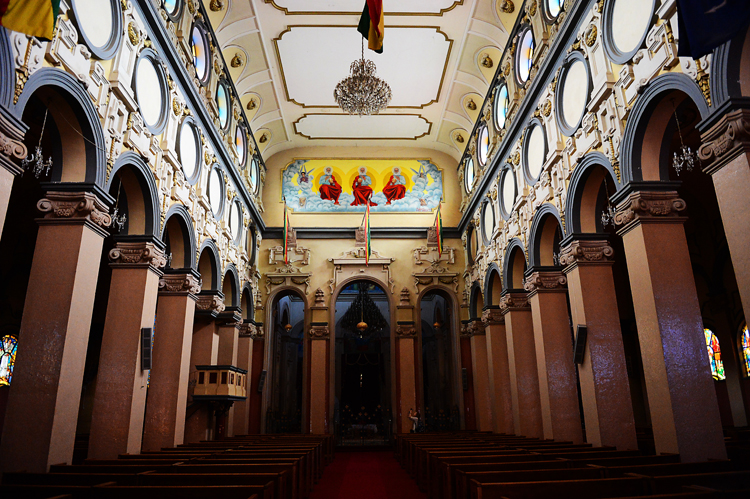
I want to click on engraved walls, so click(x=114, y=122).